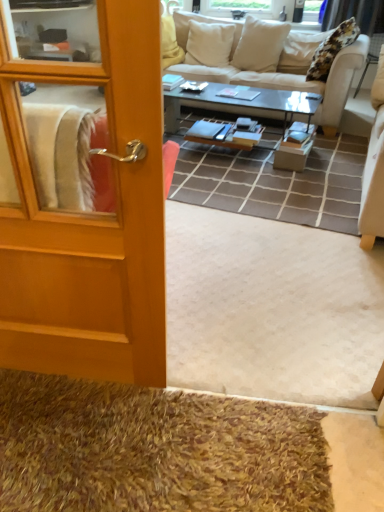
Find the location of `black glass coffee table at center`. black glass coffee table at center is located at coordinates (254, 100).

Describe the element at coordinates (154, 450) in the screenshot. I see `shaggy brown doormat at lower left` at that location.

The image size is (384, 512). Describe the element at coordinates (90, 222) in the screenshot. I see `wooden door at left` at that location.

At what (x,y) coordinates should I click in order to perform the action: click on beige fabric couch at upper center. Please return your answer as a coordinate pair (x, y). The image size is (384, 512). Looking at the image, I should click on (286, 77).

I want to click on black glass coffee table at center, so click(254, 100).

Between point (300, 112) and point (145, 466), which one is positioned in front?

Positioned in front is point (145, 466).

From the image's perspective, does black glass coffee table at center appear higher than shaggy brown doormat at lower left?

Yes, from the image's perspective, black glass coffee table at center is over shaggy brown doormat at lower left.

Is black glass coffee table at center facing away from shaggy brown doormat at lower left?

Yes, black glass coffee table at center is positioned with its back facing shaggy brown doormat at lower left.

From their relative heights in the image, would you say black glass coffee table at center is taller or shorter than shaggy brown doormat at lower left?

black glass coffee table at center is taller than shaggy brown doormat at lower left.

Which object is more forward, shaggy brown doormat at lower left or beige fabric couch at upper center?

Positioned in front is shaggy brown doormat at lower left.

Which is nearer, (206, 507) or (344, 106)?

Positioned in front is point (206, 507).

Which is more to the right, shaggy brown doormat at lower left or beige fabric couch at upper center?

From the viewer's perspective, beige fabric couch at upper center appears more on the right side.

Would you say shaggy brown doormat at lower left is inside or outside beige fabric couch at upper center?

shaggy brown doormat at lower left is not inside beige fabric couch at upper center, it's outside.

What's the angular difference between beige fabric couch at upper center and wooden door at left's facing directions?

They differ by 167 degrees in their facing directions.

Between beige fabric couch at upper center and wooden door at left, which one has smaller width?

wooden door at left.

Does beige fabric couch at upper center turn towards wooden door at left?

Yes, beige fabric couch at upper center is oriented towards wooden door at left.

From a real-world perspective, which is physically above, beige fabric couch at upper center or wooden door at left?

wooden door at left, from a real-world perspective.

From a real-world perspective, is wooden door at left beneath black glass coffee table at center?

No, from a real-world perspective, wooden door at left is not under black glass coffee table at center.

Considering the positions of objects wooden door at left and black glass coffee table at center in the image provided, who is more to the right, wooden door at left or black glass coffee table at center?

black glass coffee table at center.

How many degrees apart are the facing directions of wooden door at left and black glass coffee table at center?

There is a 9.17-degree angle between the facing directions of wooden door at left and black glass coffee table at center.

Is wooden door at left not inside black glass coffee table at center?

Yes, wooden door at left is outside of black glass coffee table at center.

Measure the distance from black glass coffee table at center to beige fabric couch at upper center.

The distance of black glass coffee table at center from beige fabric couch at upper center is 16.20 inches.

Considering the relative sizes of black glass coffee table at center and beige fabric couch at upper center in the image provided, is black glass coffee table at center thinner than beige fabric couch at upper center?

Yes, black glass coffee table at center is thinner than beige fabric couch at upper center.

Is black glass coffee table at center not within beige fabric couch at upper center?

black glass coffee table at center lies outside beige fabric couch at upper center's area.

From a real-world perspective, is black glass coffee table at center above or below beige fabric couch at upper center?

black glass coffee table at center is below beige fabric couch at upper center.

In the scene shown: Can shaggy brown doormat at lower left be found inside beige fabric couch at upper center?

No, shaggy brown doormat at lower left is not a part of beige fabric couch at upper center.

Does beige fabric couch at upper center come in front of shaggy brown doormat at lower left?

No, beige fabric couch at upper center is further to the viewer.

Where is `studio couch behind the shaggy brown doormat at lower left`? This screenshot has width=384, height=512. studio couch behind the shaggy brown doormat at lower left is located at coordinates (286, 77).

In the image, is beige fabric couch at upper center on the left side or the right side of shaggy brown doormat at lower left?

Clearly, beige fabric couch at upper center is on the right of shaggy brown doormat at lower left in the image.

What's the angular difference between shaggy brown doormat at lower left and black glass coffee table at center's facing directions?

There is a 12.3-degree angle between the facing directions of shaggy brown doormat at lower left and black glass coffee table at center.

Based on the photo, choose the correct answer: Is shaggy brown doormat at lower left inside black glass coffee table at center or outside it?

→ shaggy brown doormat at lower left lies outside black glass coffee table at center.

Can you confirm if shaggy brown doormat at lower left is wider than black glass coffee table at center?

Incorrect, the width of shaggy brown doormat at lower left does not surpass that of black glass coffee table at center.

From a real-world perspective, which is physically below, shaggy brown doormat at lower left or black glass coffee table at center?

shaggy brown doormat at lower left.

Locate an element on the screen. doormat that is in front of the black glass coffee table at center is located at coordinates (154, 450).

Locate an element on the screen. The image size is (384, 512). doormat located below the beige fabric couch at upper center (from the image's perspective) is located at coordinates (154, 450).

Looking at the image, which one is located closer to beige fabric couch at upper center, wooden door at left or shaggy brown doormat at lower left?

wooden door at left is positioned closer to the anchor beige fabric couch at upper center.

Based on their spatial positions, is black glass coffee table at center or beige fabric couch at upper center closer to wooden door at left?

Among the two, black glass coffee table at center is located nearer to wooden door at left.

From the image, which object appears to be farther from black glass coffee table at center, shaggy brown doormat at lower left or wooden door at left?

shaggy brown doormat at lower left is further to black glass coffee table at center.

Estimate the real-world distances between objects in this image. Which object is closer to shaggy brown doormat at lower left, black glass coffee table at center or beige fabric couch at upper center?

Based on the image, black glass coffee table at center appears to be nearer to shaggy brown doormat at lower left.

Considering their positions, is wooden door at left positioned closer to shaggy brown doormat at lower left than beige fabric couch at upper center?

wooden door at left is closer to shaggy brown doormat at lower left.

From the picture: When comparing their distances from beige fabric couch at upper center, does shaggy brown doormat at lower left or black glass coffee table at center seem closer?

Among the two, black glass coffee table at center is located nearer to beige fabric couch at upper center.

Considering their positions, is beige fabric couch at upper center positioned closer to wooden door at left than black glass coffee table at center?

black glass coffee table at center is positioned closer to the anchor wooden door at left.

From the image, which object appears to be nearer to black glass coffee table at center, shaggy brown doormat at lower left or beige fabric couch at upper center?

Among the two, beige fabric couch at upper center is located nearer to black glass coffee table at center.

At what (x,y) coordinates should I click in order to perform the action: click on coffee table between wooden door at left and beige fabric couch at upper center in the front-back direction. Please return your answer as a coordinate pair (x, y). Looking at the image, I should click on click(x=254, y=100).

Where is `door between beige fabric couch at upper center and shaggy brown doormat at lower left from top to bottom`? door between beige fabric couch at upper center and shaggy brown doormat at lower left from top to bottom is located at coordinates (90, 222).

At what (x,y) coordinates should I click in order to perform the action: click on doormat between wooden door at left and black glass coffee table at center from front to back. Please return your answer as a coordinate pair (x, y). This screenshot has height=512, width=384. Looking at the image, I should click on (154, 450).

The height and width of the screenshot is (512, 384). Find the location of `coffee table between beige fabric couch at upper center and shaggy brown doormat at lower left from top to bottom`. coffee table between beige fabric couch at upper center and shaggy brown doormat at lower left from top to bottom is located at coordinates (254, 100).